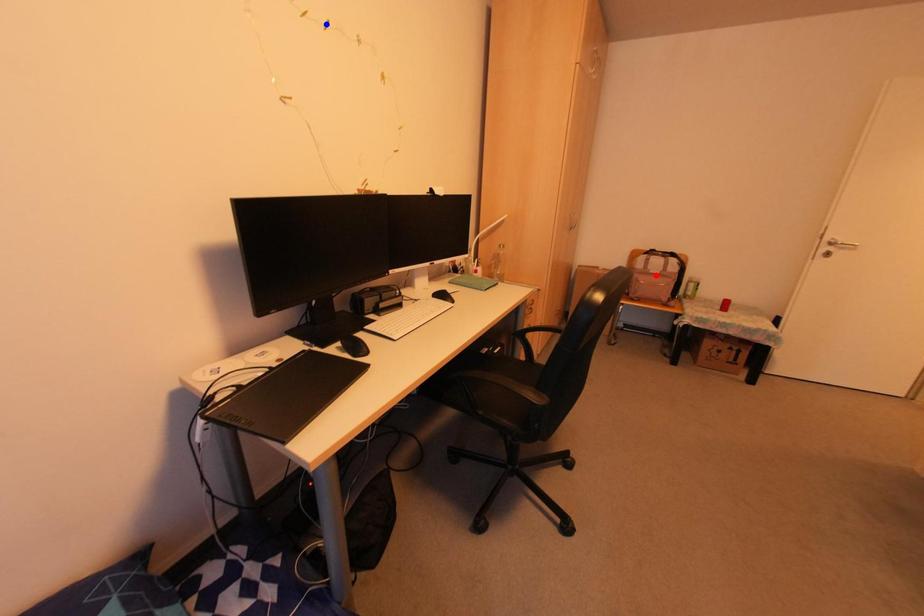
Question: In the image, two points are highlighted. Which point is nearer to the camera? Reply with the corresponding letter.

Choices:
 (A) blue point
 (B) red point

Answer: (A)